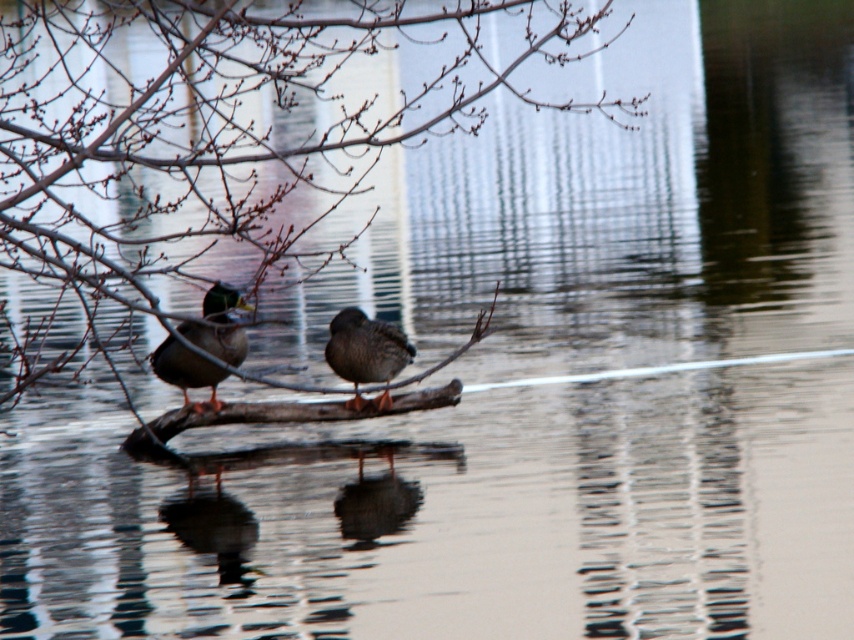
You are a photographer aiming to capture the reflection of the shiny brown duck at left in the water below. Based on the coordinates provided, where should you focus your camera to ensure the reflection is centered in your shot?

The reflection of the shiny brown duck at left will be directly below its position at coordinates approximately 0.509 on the x and 0.258 on the y. To center the reflection, adjust your camera to focus at the same coordinates.

Looking at this image, you are an ornithologist observing ducks in a natural habitat. You notice the shiny brown duck at left and the bare branches at center. Based on their sizes in the image, which object would cast a larger shadow on the ground below?

The bare branches at center has a larger width than the shiny brown duck at left, so it would cast a larger shadow on the ground below.

You are a birdwatcher trying to observe the brown matte duck at center from the shore. The bare branches at center are blocking your view. Can you see the duck clearly? Explain why or why not.

The bare branches at center are closer to the viewer than the brown matte duck at center, so the branches block the view of the duck.